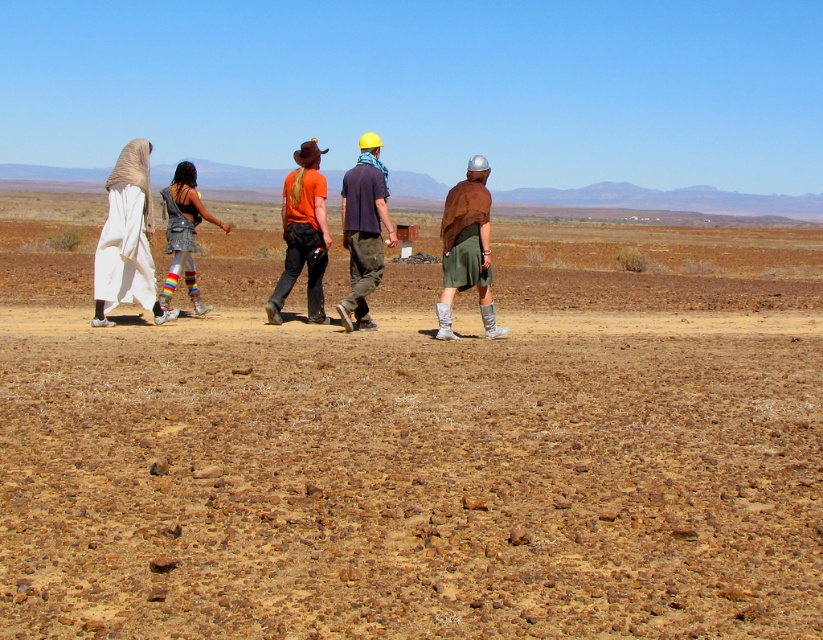
Question: Which object is positioned closest to the orange t-shirt at center?

Choices:
 (A) dark purple shirt at center
 (B) brown rocky ground at center
 (C) brown fabric cape at center
 (D) metallic silver dress at center

Answer: (A)

Question: Can you confirm if brown fabric cape at center is positioned to the left of metallic silver dress at center?

Choices:
 (A) no
 (B) yes

Answer: (A)

Question: Among these points, which one is farthest from the camera?

Choices:
 (A) (10, 584)
 (B) (375, 176)

Answer: (B)

Question: Does brown fabric cape at center appear on the right side of metallic silver dress at center?

Choices:
 (A) yes
 (B) no

Answer: (A)

Question: Is brown rocky ground at center closer to camera compared to white fabric headscarf at left?

Choices:
 (A) yes
 (B) no

Answer: (A)

Question: Considering the real-world distances, which object is farthest from the brown rocky ground at center?

Choices:
 (A) metallic silver dress at center
 (B) brown fabric cape at center
 (C) orange t-shirt at center

Answer: (B)